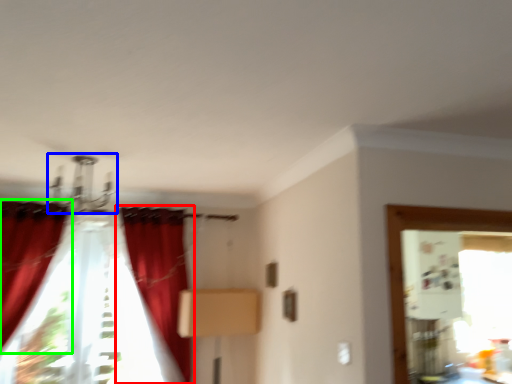
Question: Estimate the real-world distances between objects in this image. Which object is farther from curtain (highlighted by a red box), light fixture (highlighted by a blue box) or curtain (highlighted by a green box)?

Choices:
 (A) light fixture
 (B) curtain

Answer: (B)